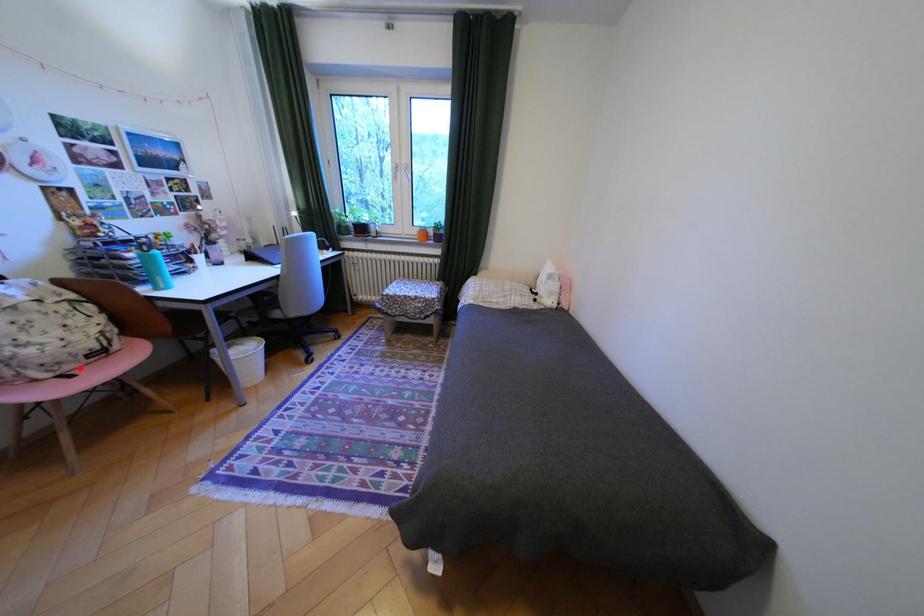
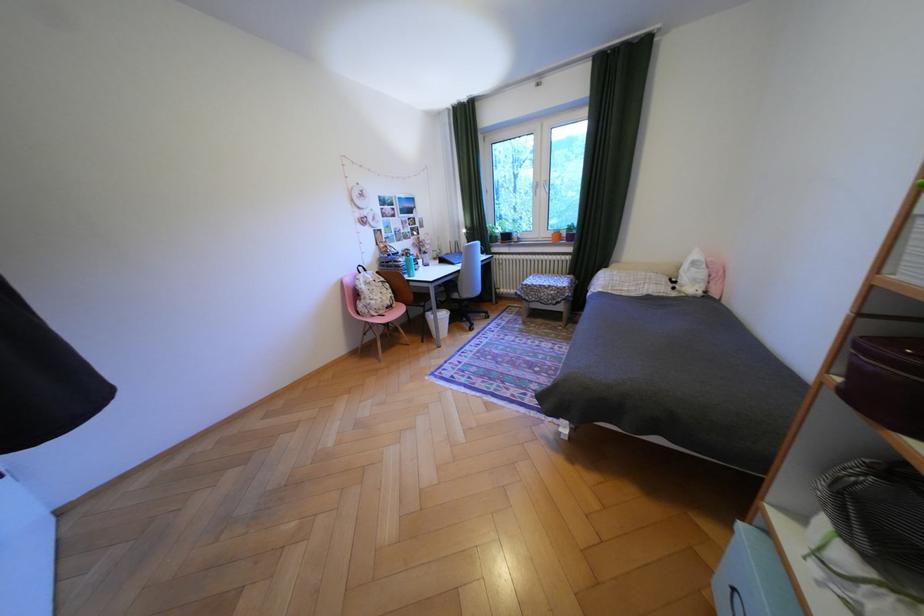
In the second image, find the point that corresponds to the highlighted location in the first image.

(393, 312)